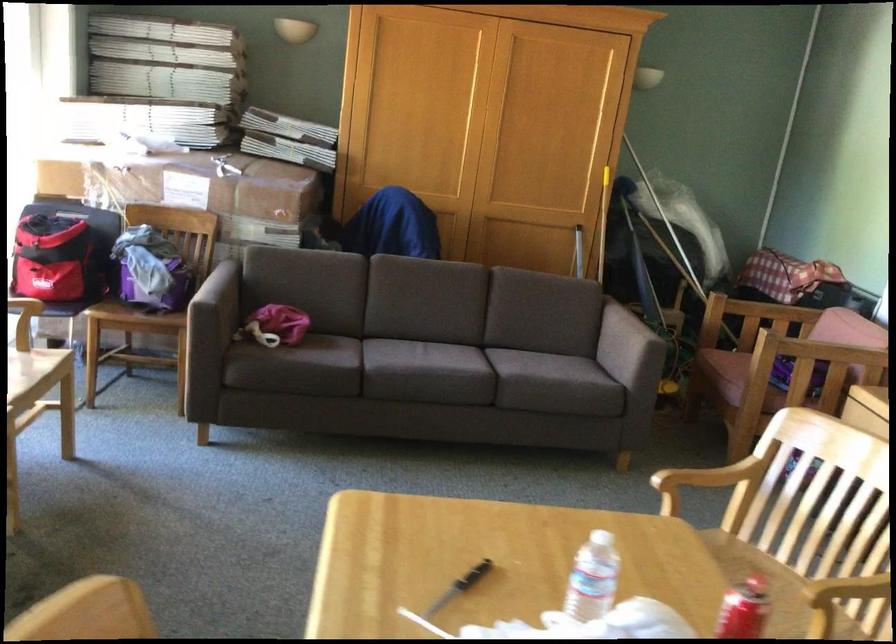
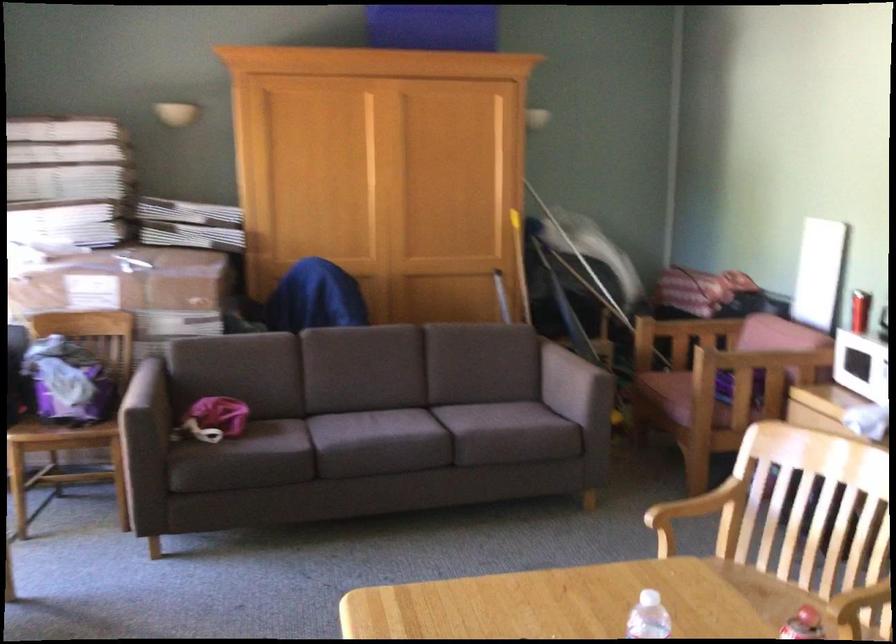
Where in the second image is the point corresponding to (219,194) from the first image?

(131, 290)